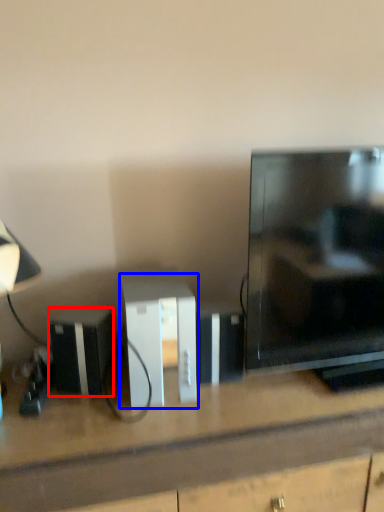
Question: Among these objects, which one is nearest to the camera, appliance (highlighted by a red box) or cabinetry (highlighted by a blue box)?

Choices:
 (A) appliance
 (B) cabinetry

Answer: (B)